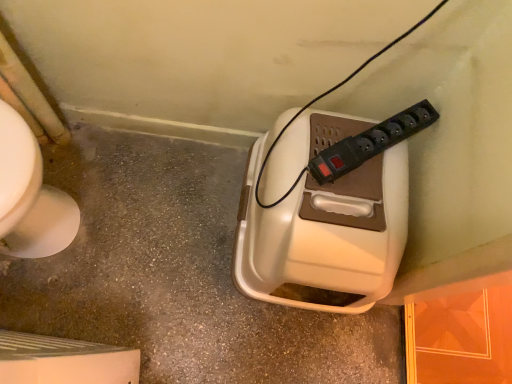
Question: Can you confirm if beige plastic container at center is positioned to the right of white plastic hand dryer at center?

Choices:
 (A) yes
 (B) no

Answer: (B)

Question: Is beige plastic container at center not inside white plastic hand dryer at center?

Choices:
 (A) no
 (B) yes

Answer: (B)

Question: Can you see beige plastic container at center touching white plastic hand dryer at center?

Choices:
 (A) yes
 (B) no

Answer: (B)

Question: From the image's perspective, is beige plastic container at center above white plastic hand dryer at center?

Choices:
 (A) yes
 (B) no

Answer: (B)

Question: Could white plastic hand dryer at center be considered to be inside beige plastic container at center?

Choices:
 (A) no
 (B) yes

Answer: (A)

Question: Considering the positions of point (379, 291) and point (31, 302), is point (379, 291) closer or farther from the camera than point (31, 302)?

Choices:
 (A) closer
 (B) farther

Answer: (A)

Question: Is white plastic hand dryer at center spatially inside beige plastic container at center, or outside of it?

Choices:
 (A) outside
 (B) inside

Answer: (A)

Question: From the image's perspective, is white plastic hand dryer at center located above or below beige plastic container at center?

Choices:
 (A) above
 (B) below

Answer: (A)

Question: Visually, is white plastic hand dryer at center positioned to the left or to the right of beige plastic container at center?

Choices:
 (A) left
 (B) right

Answer: (B)

Question: Is beige plastic container at center inside the boundaries of white plastic hand dryer at center, or outside?

Choices:
 (A) inside
 (B) outside

Answer: (B)

Question: Is beige plastic container at center bigger or smaller than white plastic hand dryer at center?

Choices:
 (A) small
 (B) big

Answer: (A)

Question: Looking at their shapes, would you say beige plastic container at center is wider or thinner than white plastic hand dryer at center?

Choices:
 (A) wide
 (B) thin

Answer: (A)

Question: Is point 125,213 closer or farther from the camera than point 321,230?

Choices:
 (A) farther
 (B) closer

Answer: (A)

Question: Considering the positions of point (395, 377) and point (362, 152), is point (395, 377) closer or farther from the camera than point (362, 152)?

Choices:
 (A) closer
 (B) farther

Answer: (B)

Question: Would you say beige plastic container at center is to the left or to the right of black plastic power plugs and sockets at upper center in the picture?

Choices:
 (A) right
 (B) left

Answer: (B)